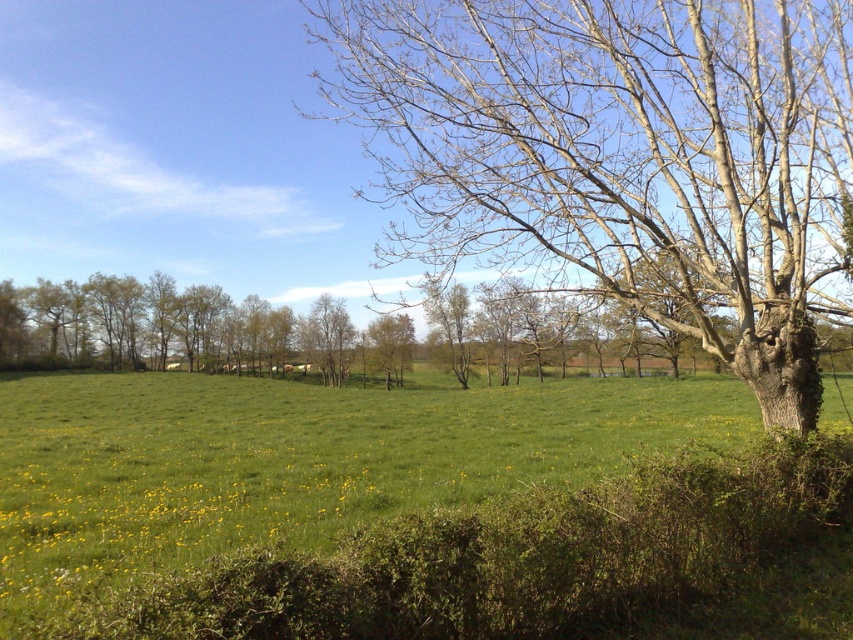
Which is in front, point (200, 484) or point (397, 349)?

Point (200, 484) is more forward.

Is green grassy pasture at center closer to the viewer compared to green leafy tree at center?

That is True.

Which is behind, point (62, 454) or point (409, 360)?

The point (409, 360) is behind.

This screenshot has width=853, height=640. In order to click on green grassy pasture at center in this screenshot , I will do `click(293, 458)`.

Does bare wood tree at center have a lesser height compared to green leafy tree at center?

No, bare wood tree at center is not shorter than green leafy tree at center.

Does bare wood tree at center have a smaller size compared to green leafy tree at center?

Incorrect, bare wood tree at center is not smaller in size than green leafy tree at center.

Who is more forward, (515, 109) or (403, 321)?

Positioned in front is point (515, 109).

The width and height of the screenshot is (853, 640). I want to click on bare wood tree at center, so click(611, 157).

Between bare wood tree at center and green grassy pasture at center, which one has more height?

bare wood tree at center

Is bare wood tree at center to the left of green grassy pasture at center from the viewer's perspective?

Incorrect, bare wood tree at center is not on the left side of green grassy pasture at center.

Does point (712, 275) come closer to viewer compared to point (219, 512)?

Yes, point (712, 275) is closer to viewer.

At what (x,y) coordinates should I click in order to perform the action: click on bare wood tree at center. Please return your answer as a coordinate pair (x, y). The height and width of the screenshot is (640, 853). Looking at the image, I should click on (611, 157).